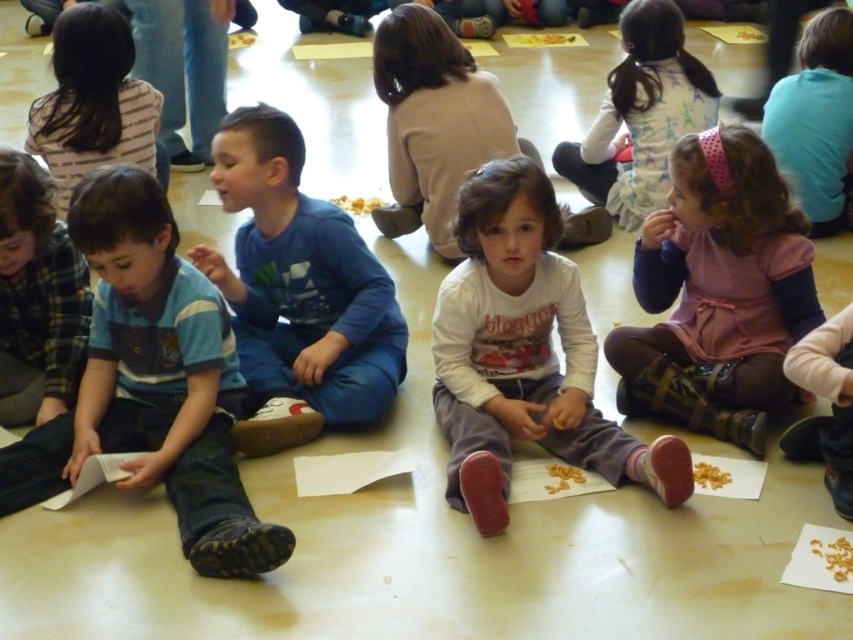
Question: Among these objects, which one is nearest to the camera?

Choices:
 (A) white cotton dress at upper center
 (B) blue denim jeans at left

Answer: (B)

Question: Observing the image, what is the correct spatial positioning of blue denim jeans at left in reference to white cotton dress at upper center?

Choices:
 (A) left
 (B) right

Answer: (A)

Question: Can you confirm if white cotton dress at upper center is smaller than pink fabric dress at upper right?

Choices:
 (A) no
 (B) yes

Answer: (A)

Question: Which of the following is the closest to the observer?

Choices:
 (A) (166, 179)
 (B) (473, 301)
 (C) (563, 150)
 (D) (811, 77)

Answer: (B)

Question: Which point is closer to the camera taking this photo?

Choices:
 (A) (635, 465)
 (B) (195, 490)
 (C) (310, 257)
 (D) (616, 76)

Answer: (B)

Question: Is blue denim jeans at left closer to camera compared to white cotton shirt at center?

Choices:
 (A) no
 (B) yes

Answer: (B)